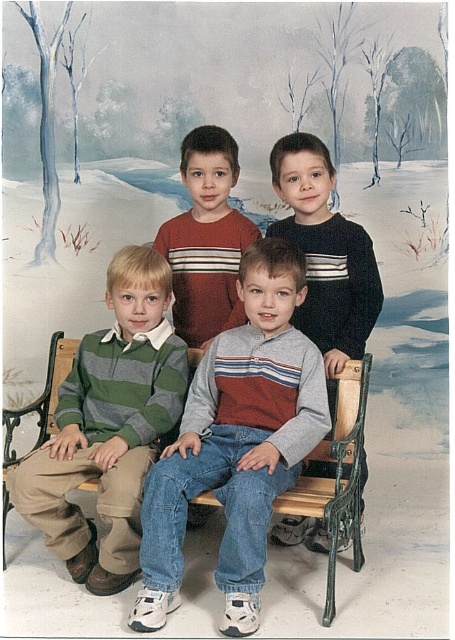
You are a photographer arranging two sweaters for a winter photo shoot. You have a striped knit sweater at center and a green striped sweater at left. Based on the scene description, which sweater should you place on the larger mannequin?

The striped knit sweater at center is larger in size than the green striped sweater at left, so it should be placed on the larger mannequin.

You are a photographer adjusting the lighting for the group portrait. You need to ensure that the striped knit sweater at center and the green striped sweater at left are evenly lit. Given their distance apart, can you estimate how far apart they are to adjust the light sources appropriately?

The striped knit sweater at center is 10.85 inches away from the green striped sweater at left, so you should position the light sources about 10.85 inches apart to ensure even lighting between them.